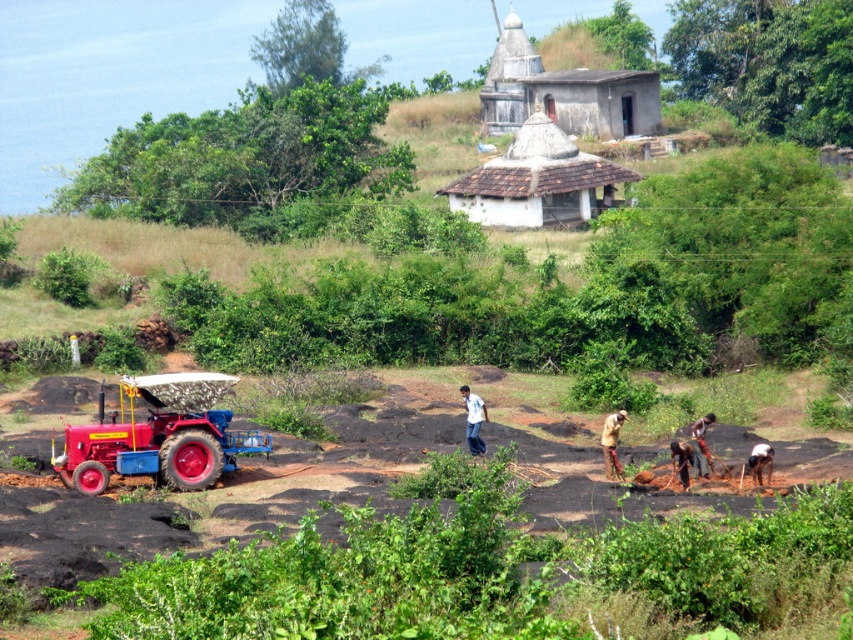
Question: Which of the following is the closest to the observer?

Choices:
 (A) white stucco temple at upper center
 (B) brown fabric shirt at lower right
 (C) white cotton shirt at center

Answer: (B)

Question: Can you confirm if shiny red tractor at left is positioned above dark brown skin at lower right?

Choices:
 (A) no
 (B) yes

Answer: (B)

Question: Does white cotton shirt at center lie in front of dark brown skin at lower right?

Choices:
 (A) yes
 (B) no

Answer: (B)

Question: Considering the real-world distances, which object is farthest from the shiny red tractor at left?

Choices:
 (A) white cotton shirt at center
 (B) white clay hut at upper center
 (C) brown fabric shirt at center

Answer: (B)

Question: Can you confirm if brown fabric at lower right is thinner than dark brown skin at lower right?

Choices:
 (A) no
 (B) yes

Answer: (A)

Question: Which point is farther to the camera?

Choices:
 (A) white stucco temple at upper center
 (B) shiny red tractor at left
 (C) brown fabric at lower right

Answer: (A)